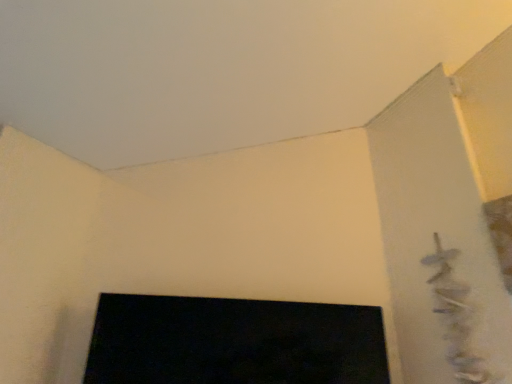
This screenshot has width=512, height=384. What do you see at coordinates (234, 342) in the screenshot?
I see `black matte computer screen at bottom` at bounding box center [234, 342].

Locate an element on the screen. This screenshot has height=384, width=512. black matte computer screen at bottom is located at coordinates click(x=234, y=342).

I want to click on black matte computer screen at bottom, so click(x=234, y=342).